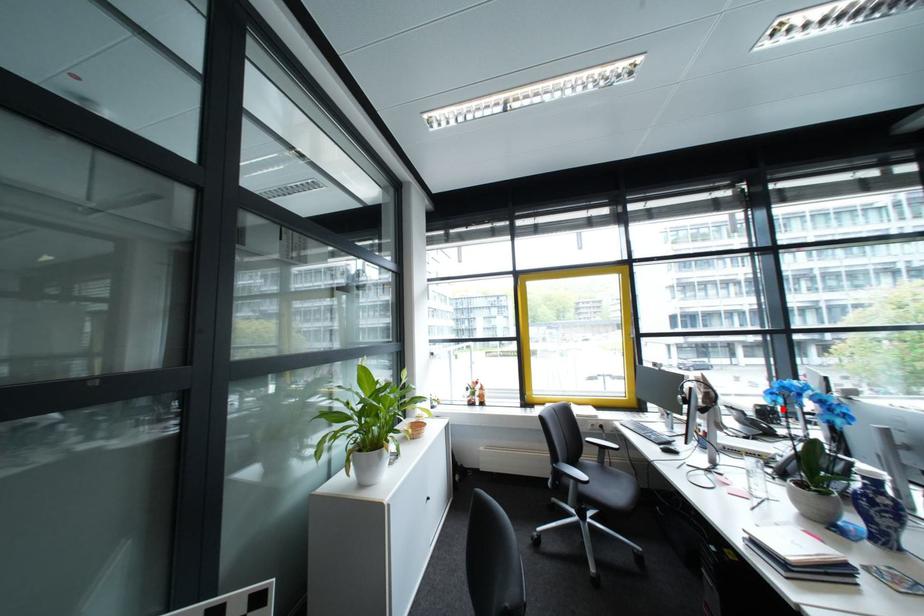
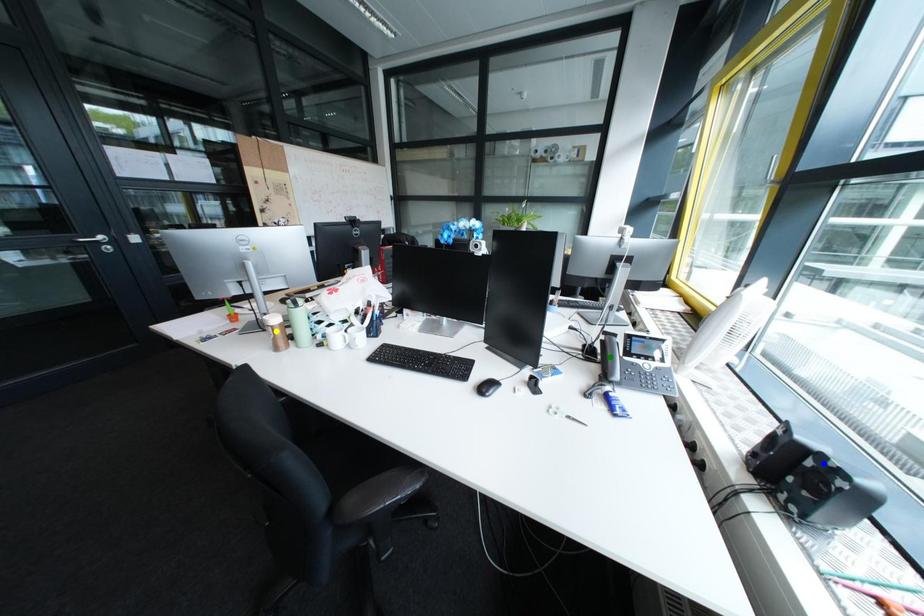
Question: I am providing you with two images of the same scene from different viewpoints. A red point is marked on the first image. You are given multiple points on the second image. In image 2, which mark is for the same physical point as the one in image 1?

Choices:
 (A) yellow point
 (B) green point
 (C) blue point

Answer: (C)